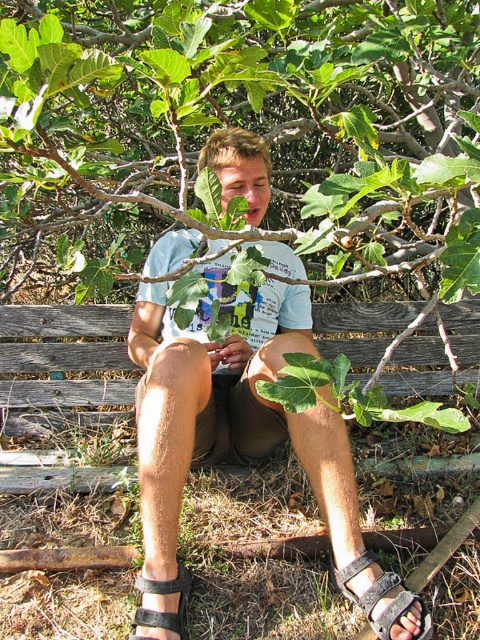
You are standing at the point with coordinates point (419, 182) and want to walk towards the point (127, 365). Which direction should you move to reach your destination?

To reach point (127, 365) from point (419, 182), you should move towards the lower right direction since point (419, 182) is in front of point (127, 365).

You are standing in a park and want to sit on the weathered wood park bench at lower center. To do so, do you need to walk around the green leafy tree at center?

The green leafy tree at center is closer to the viewer than the weathered wood park bench at lower center. Therefore, you would need to walk around the green leafy tree at center to reach the weathered wood park bench at lower center.